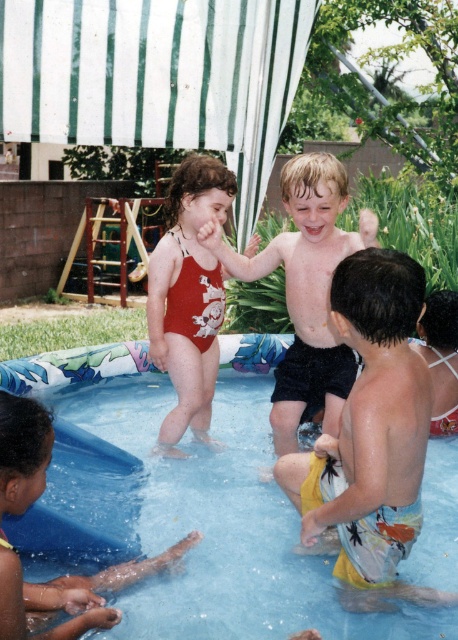
Question: Which point is closer to the camera taking this photo?

Choices:
 (A) (180, 220)
 (B) (105, 621)
 (C) (363, 436)
 (D) (331, 333)

Answer: (C)

Question: Can you confirm if yellow printed shorts at lower right is positioned below yellow rubber band at lower left?

Choices:
 (A) yes
 (B) no

Answer: (B)

Question: Among these objects, which one is nearest to the camera?

Choices:
 (A) smooth black shorts at center
 (B) blue rubber pool at center
 (C) yellow printed shorts at lower right
 (D) matte red swimsuit at center

Answer: (C)

Question: Is yellow printed shorts at lower right positioned behind smooth black shorts at center?

Choices:
 (A) no
 (B) yes

Answer: (A)

Question: Based on their relative distances, which object is farther from the blue rubber pool at center?

Choices:
 (A) yellow printed shorts at lower right
 (B) matte red swimsuit at center

Answer: (A)

Question: Is yellow printed shorts at lower right wider than matte red swimsuit at center?

Choices:
 (A) no
 (B) yes

Answer: (B)